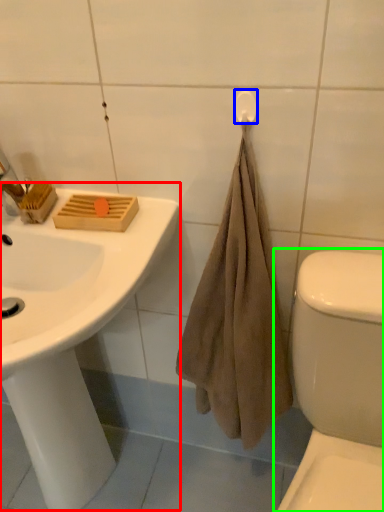
Question: Estimate the real-world distances between objects in this image. Which object is closer to sink (highlighted by a red box), towel bar (highlighted by a blue box) or toilet (highlighted by a green box)?

Choices:
 (A) towel bar
 (B) toilet

Answer: (B)